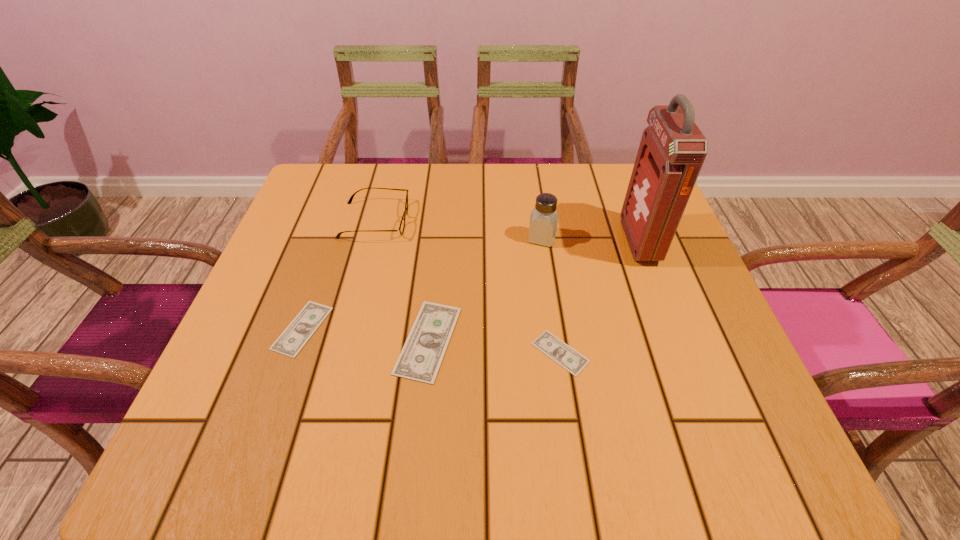
Find the location of a particular element. The image size is (960, 540). vacant point located between the shortest money and the spectacles is located at coordinates (468, 287).

You are a GUI agent. You are given a task and a screenshot of the screen. Output one action in this format:
    pyautogui.click(x=<x>, y=<y>)
    Task: Click on the free spot between the fifth shortest object and the first-aid kit
    
    Given the screenshot: What is the action you would take?
    pyautogui.click(x=590, y=240)

Where is `free space that is in between the saltshaker and the rightmost money`? free space that is in between the saltshaker and the rightmost money is located at coordinates (551, 295).

Where is `empty space that is in between the leftmost money and the rightmost object`? empty space that is in between the leftmost money and the rightmost object is located at coordinates (470, 285).

The image size is (960, 540). In order to click on free point between the saltshaker and the second tallest money in this screenshot , I will do `click(422, 284)`.

The height and width of the screenshot is (540, 960). In order to click on vacant area between the leftmost money and the fourth shortest object in this screenshot , I will do `click(339, 274)`.

Image resolution: width=960 pixels, height=540 pixels. What are the coordinates of `empty space that is in between the fifth shortest object and the spectacles` in the screenshot? It's located at (459, 230).

In order to click on free space that is in between the rightmost object and the second shortest money in this screenshot , I will do `click(470, 285)`.

The image size is (960, 540). I want to click on free spot between the fifth shortest object and the third shortest object, so click(x=485, y=289).

Locate an element on the screen. Image resolution: width=960 pixels, height=540 pixels. free space that is in between the fourth object from right to left and the spectacles is located at coordinates (401, 280).